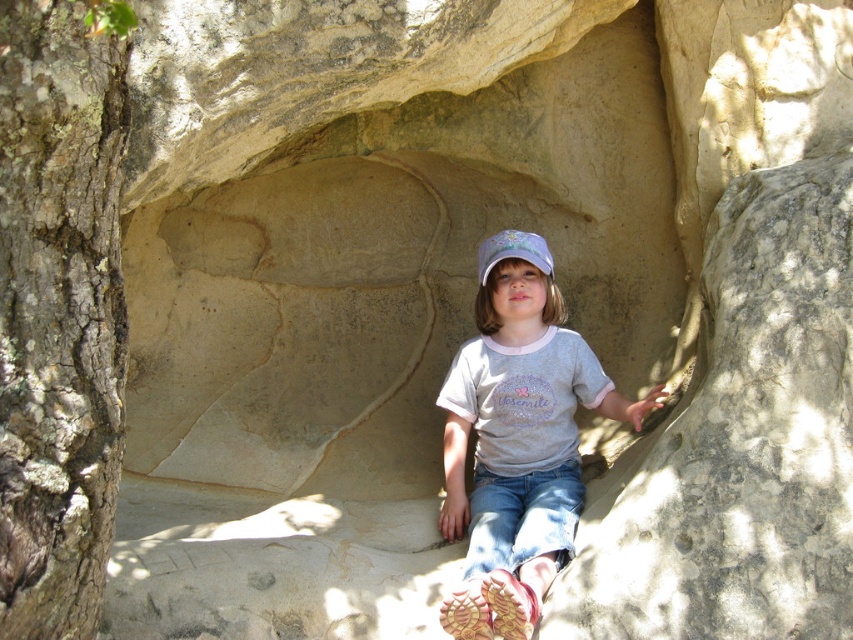
Who is positioned more to the left, brown rough bark tree at left or white cotton cap at center?

brown rough bark tree at left

Does point (105, 376) come closer to viewer compared to point (483, 275)?

Yes, point (105, 376) is closer to viewer.

This screenshot has width=853, height=640. Find the location of `brown rough bark tree at left`. brown rough bark tree at left is located at coordinates (59, 312).

Which of these two, brown rough bark tree at left or matte gray shirt at center, stands taller?

brown rough bark tree at left

The image size is (853, 640). What do you see at coordinates (59, 312) in the screenshot?
I see `brown rough bark tree at left` at bounding box center [59, 312].

Image resolution: width=853 pixels, height=640 pixels. In order to click on brown rough bark tree at left in this screenshot , I will do `click(59, 312)`.

Between matte gray shirt at center and white cotton cap at center, which one is positioned lower?

matte gray shirt at center

Who is taller, matte gray shirt at center or white cotton cap at center?

matte gray shirt at center is taller.

Does point (596, 368) come behind point (506, 248)?

Yes, it is.

What are the coordinates of `matte gray shirt at center` in the screenshot? It's located at (518, 449).